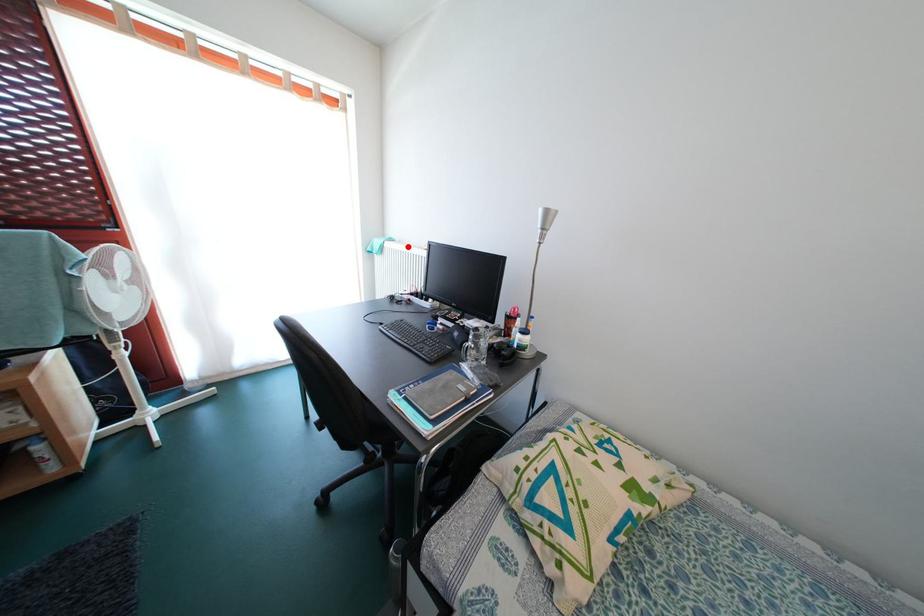
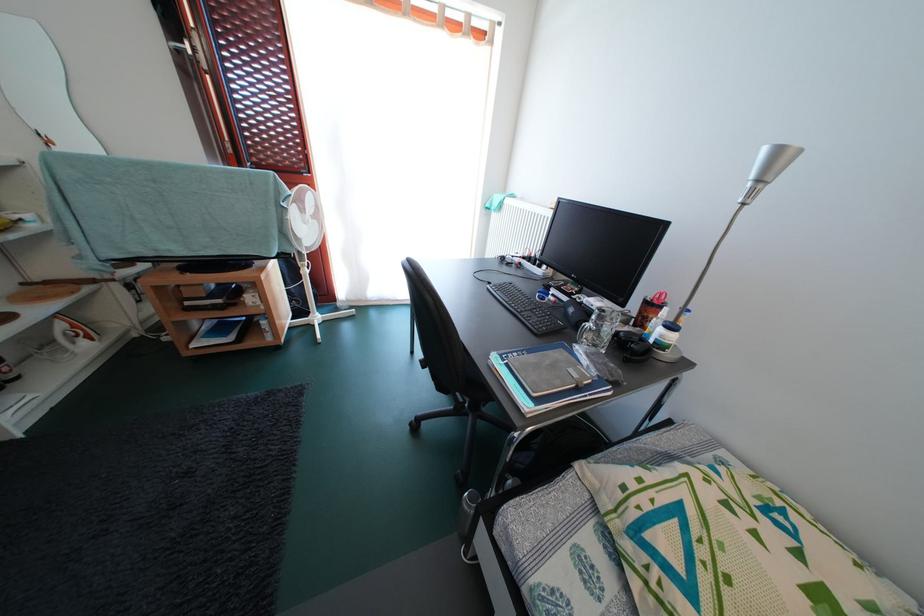
Question: I am providing you with two images of the same scene from different viewpoints. Given a red point in image1, look at the same physical point in image2. Is it:

Choices:
 (A) Closer to the viewpoint
 (B) Farther from the viewpoint

Answer: (A)